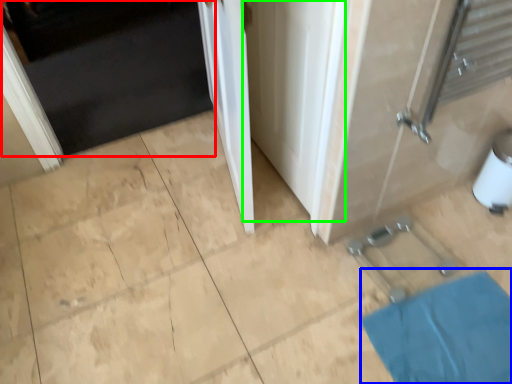
Question: Which is farther away from door (highlighted by a red box)? bath mat (highlighted by a blue box) or screen door (highlighted by a green box)?

Choices:
 (A) bath mat
 (B) screen door

Answer: (A)